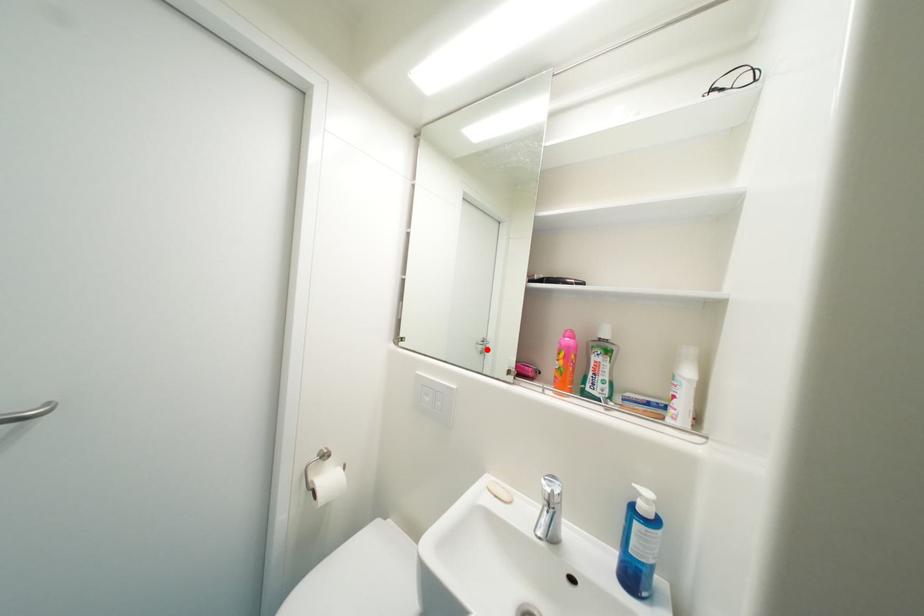
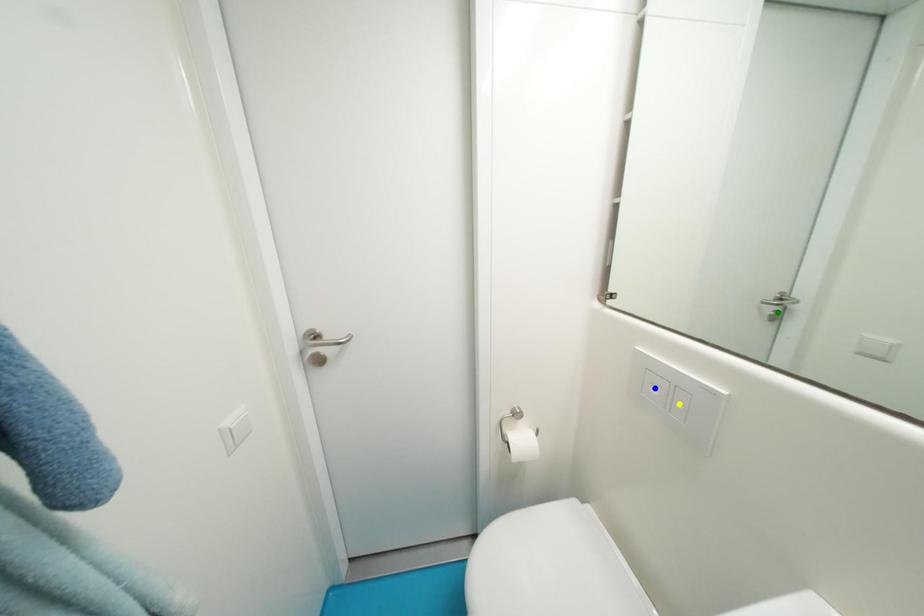
Question: I am providing you with two images of the same scene from different viewpoints. A red point is marked on the first image. You are given multiple points on the second image. In image 2, which mark is for the same physical point as the one in image 1?

Choices:
 (A) yellow point
 (B) blue point
 (C) green point

Answer: (C)